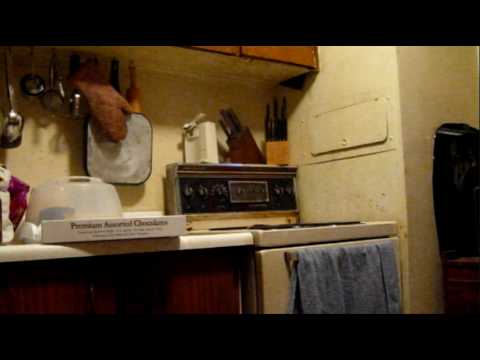
At what (x,y) coordinates should I click in order to perform the action: click on oven mit. Please return your answer as a coordinate pair (x, y). Image resolution: width=480 pixels, height=360 pixels. Looking at the image, I should click on (105, 109), (97, 88).